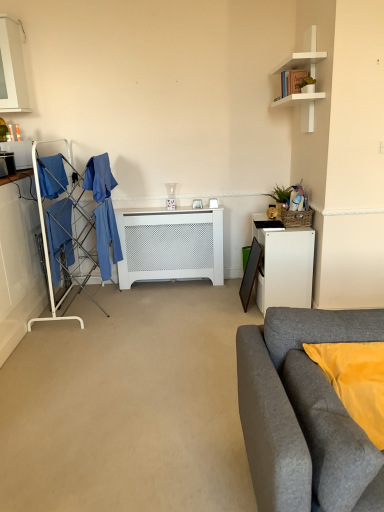
Where is `white glossy cabinet at upper left`? The width and height of the screenshot is (384, 512). white glossy cabinet at upper left is located at coordinates (12, 69).

Where is `white matte shelf at upper right`? Image resolution: width=384 pixels, height=512 pixels. white matte shelf at upper right is located at coordinates (304, 55).

Where is `white matte desk at right`? The height and width of the screenshot is (512, 384). white matte desk at right is located at coordinates (284, 265).

Locate an element on the screen. The width and height of the screenshot is (384, 512). white glossy cabinet at upper left is located at coordinates (12, 69).

Which is more to the left, matte black microwave at left or white matte shelf at upper right?

matte black microwave at left.

From the image's perspective, is matte black microwave at left located above or below white matte shelf at upper right?

matte black microwave at left is below white matte shelf at upper right.

Is matte black microwave at left spatially inside white matte shelf at upper right, or outside of it?

The correct answer is: outside.

Between matte black microwave at left and white matte shelf at upper right, which one has smaller width?

Thinner between the two is matte black microwave at left.

How different are the orientations of white glossy cabinet at upper left and green matte plant at upper right, which is the 2th houseplant from bottom to top, in degrees?

white glossy cabinet at upper left and green matte plant at upper right, which is the 2th houseplant from bottom to top, are facing 89.5 degrees away from each other.

Is white glossy cabinet at upper left to the left or to the right of green matte plant at upper right, which is the first houseplant from front to back, in the image?

Based on their positions, white glossy cabinet at upper left is located to the left of green matte plant at upper right, which is the first houseplant from front to back.

I want to click on houseplant in front of the white glossy cabinet at upper left, so click(x=308, y=85).

Is white glossy cabinet at upper left further to the viewer compared to green matte plant at upper right, which is the first houseplant from front to back?

That is True.

Which object is positioned more to the left, matte black picture frame at right or gray fabric couch at lower right?

matte black picture frame at right.

Identify the location of picture frame behind the gray fabric couch at lower right. (250, 273).

Is matte black picture frame at right oriented away from gray fabric couch at lower right?

No, matte black picture frame at right is not facing away from gray fabric couch at lower right.

Based on the photo, looking at their sizes, would you say matte black picture frame at right is wider or thinner than gray fabric couch at lower right?

matte black picture frame at right is thinner than gray fabric couch at lower right.

Does white matte desk at right appear on the right side of white glossy cabinet at upper left?

Yes, white matte desk at right is to the right of white glossy cabinet at upper left.

You are a GUI agent. You are given a task and a screenshot of the screen. Output one action in this format:
    pyautogui.click(x=<x>, y=<y>)
    Task: Click on the cabinetry located on the left of white matte desk at right
    
    Given the screenshot: What is the action you would take?
    pyautogui.click(x=12, y=69)

Consider the image. Is there a large distance between white matte desk at right and white glossy cabinet at upper left?

Yes, white matte desk at right and white glossy cabinet at upper left are quite far apart.

Measure the distance from matte black picture frame at right to green woven basket at upper right, which ranks as the second houseplant in front-to-back order.

matte black picture frame at right is 19.23 inches from green woven basket at upper right, which ranks as the second houseplant in front-to-back order.

The width and height of the screenshot is (384, 512). I want to click on picture frame located underneath the green woven basket at upper right, marked as the first houseplant in a bottom-to-top arrangement (from a real-world perspective), so click(x=250, y=273).

Considering the relative sizes of matte black picture frame at right and green woven basket at upper right, which ranks as the second houseplant in front-to-back order, in the image provided, is matte black picture frame at right taller than green woven basket at upper right, which ranks as the second houseplant in front-to-back order,?

Indeed, matte black picture frame at right has a greater height compared to green woven basket at upper right, which ranks as the second houseplant in front-to-back order.

Could you tell me if matte black picture frame at right is turned towards green woven basket at upper right, acting as the first houseplant starting from the back?

No, matte black picture frame at right is not aimed at green woven basket at upper right, acting as the first houseplant starting from the back.

Is white matte shelf at upper right spatially inside white matte desk at right, or outside of it?

white matte shelf at upper right is located beyond the bounds of white matte desk at right.

Is white matte shelf at upper right bigger than white matte desk at right?

No, white matte shelf at upper right is not bigger than white matte desk at right.

From a real-world perspective, who is located higher, white matte shelf at upper right or white matte desk at right?

white matte shelf at upper right, from a real-world perspective.

Is white matte radiator at center at the back of white matte desk at right?

No, white matte desk at right is not facing away from white matte radiator at center.

Is white matte desk at right positioned behind white matte radiator at center?

That is False.

Does white matte desk at right have a lesser width compared to white matte radiator at center?

In fact, white matte desk at right might be wider than white matte radiator at center.

Is the surface of white matte desk at right in direct contact with white matte radiator at center?

No, white matte desk at right is not next to white matte radiator at center.

Where is `shelf above the matte black microwave at left (from a real-world perspective)`? The height and width of the screenshot is (512, 384). shelf above the matte black microwave at left (from a real-world perspective) is located at coordinates (304, 55).

Locate an element on the screen. houseplant in front of the white glossy cabinet at upper left is located at coordinates (308, 85).

From the picture: From the image, which object appears to be farther from matte black picture frame at right, blue fabric drying rack at left or white glossy cabinet at upper left?

white glossy cabinet at upper left lies further to matte black picture frame at right than the other object.

When comparing their distances from green woven basket at upper right, which ranks as the second houseplant in front-to-back order, does blue fabric drying rack at left or gray fabric couch at lower right seem closer?

blue fabric drying rack at left lies closer to green woven basket at upper right, which ranks as the second houseplant in front-to-back order, than the other object.

When comparing their distances from white glossy cabinet at upper left, does white matte shelf at upper right or gray fabric couch at lower right seem closer?

white matte shelf at upper right lies closer to white glossy cabinet at upper left than the other object.

When comparing their distances from blue fabric drying rack at left, does white matte desk at right or matte black microwave at left seem further?

white matte desk at right is positioned further to the anchor blue fabric drying rack at left.

Estimate the real-world distances between objects in this image. Which object is closer to gray fabric couch at lower right, matte black microwave at left or white glossy cabinet at upper left?

Among the two, matte black microwave at left is located nearer to gray fabric couch at lower right.

Estimate the real-world distances between objects in this image. Which object is further from white matte radiator at center, matte black picture frame at right or gray fabric couch at lower right?

Among the two, gray fabric couch at lower right is located further to white matte radiator at center.

From the picture: Estimate the real-world distances between objects in this image. Which object is further from green woven basket at upper right, acting as the first houseplant starting from the back, matte black picture frame at right or green matte plant at upper right, which is the 2th houseplant from bottom to top?

Based on the image, green matte plant at upper right, which is the 2th houseplant from bottom to top, appears to be further to green woven basket at upper right, acting as the first houseplant starting from the back.

Which object lies nearer to the anchor point white matte shelf at upper right, gray fabric couch at lower right or matte black microwave at left?

gray fabric couch at lower right is closer to white matte shelf at upper right.

Find the location of `shelf between gray fabric couch at lower right and white matte desk at right in the front-back direction`. shelf between gray fabric couch at lower right and white matte desk at right in the front-back direction is located at coordinates (304, 55).

At what (x,y) coordinates should I click in order to perform the action: click on picture frame between matte black microwave at left and green matte plant at upper right, which is the first houseplant from front to back, from left to right. Please return your answer as a coordinate pair (x, y). Looking at the image, I should click on (250, 273).

Identify the location of table situated between matte black microwave at left and white matte desk at right from left to right. Image resolution: width=384 pixels, height=512 pixels. (170, 246).

I want to click on desk between matte black microwave at left and white matte shelf at upper right in the horizontal direction, so click(284, 265).